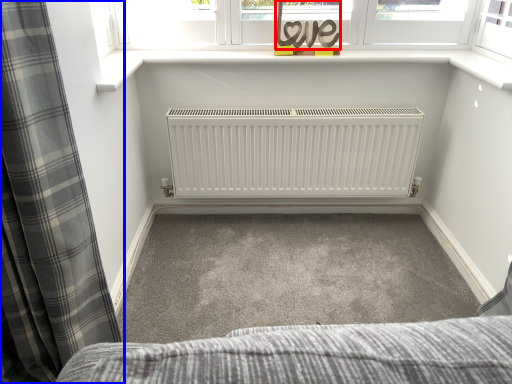
Question: Among these objects, which one is farthest to the camera, writing (highlighted by a red box) or curtain (highlighted by a blue box)?

Choices:
 (A) writing
 (B) curtain

Answer: (A)